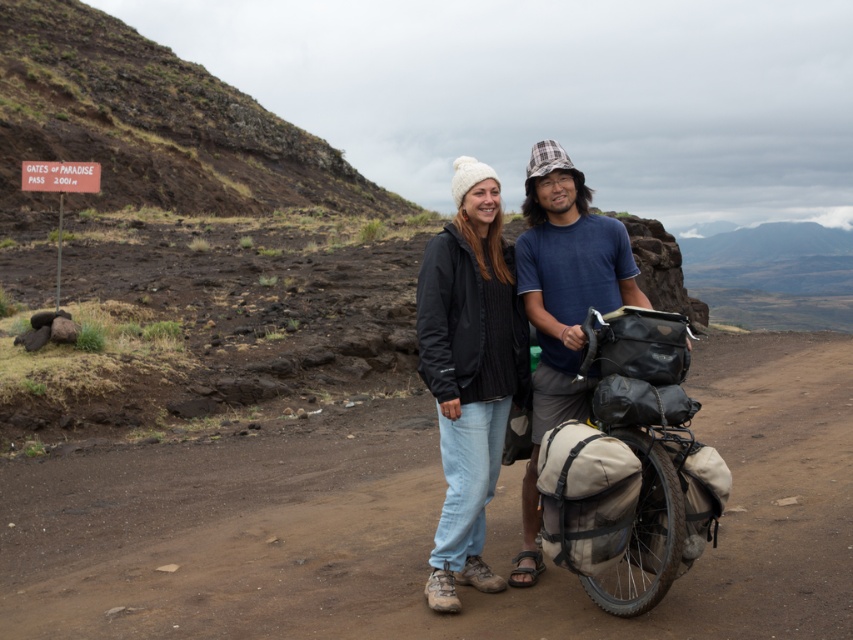
Is brown rocky hillside at upper left to the left of matte black jacket at center from the viewer's perspective?

Indeed, brown rocky hillside at upper left is positioned on the left side of matte black jacket at center.

Does brown rocky hillside at upper left appear over matte black jacket at center?

Yes.

Who is more distant from viewer, (316, 173) or (440, 365)?

The point (316, 173) is behind.

Where is `brown rocky hillside at upper left`? This screenshot has height=640, width=853. brown rocky hillside at upper left is located at coordinates (152, 124).

Consider the image. Can you confirm if brown dirt track at center is shorter than matte black jacket at center?

Indeed, brown dirt track at center has a lesser height compared to matte black jacket at center.

What do you see at coordinates (422, 524) in the screenshot? This screenshot has width=853, height=640. I see `brown dirt track at center` at bounding box center [422, 524].

At what (x,y) coordinates should I click in order to perform the action: click on brown dirt track at center. Please return your answer as a coordinate pair (x, y). Looking at the image, I should click on tap(422, 524).

Where is `brown dirt track at center`? brown dirt track at center is located at coordinates (422, 524).

How far apart are black fleece jacket at center and matte black jacket at center?

black fleece jacket at center is 6.51 inches away from matte black jacket at center.

Can you confirm if black fleece jacket at center is positioned to the left of matte black jacket at center?

No, black fleece jacket at center is not to the left of matte black jacket at center.

Between point (486, 246) and point (474, 404), which one is positioned behind?

The point (486, 246) is behind.

Find the location of `black fleece jacket at center`. black fleece jacket at center is located at coordinates (527, 316).